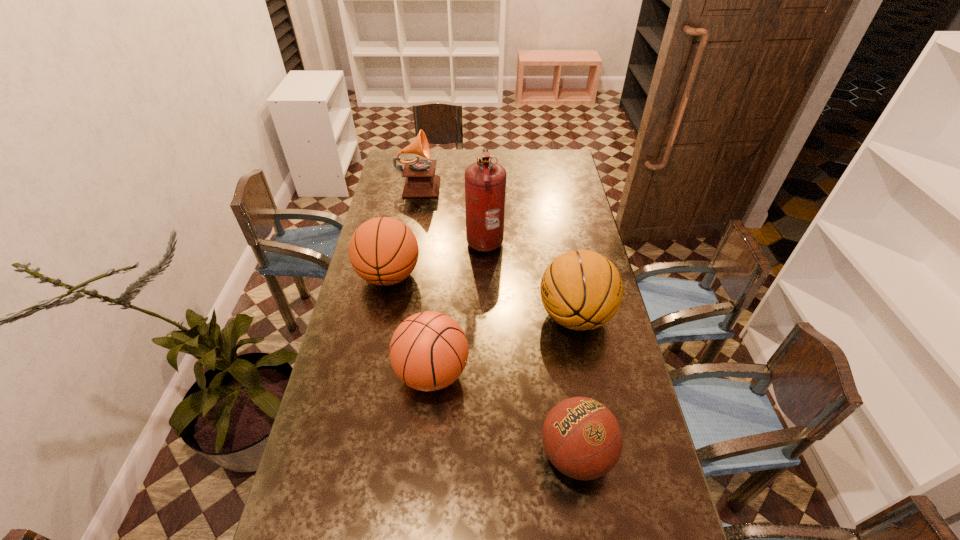
I want to click on phonograph record that is at the left edge, so click(421, 182).

The image size is (960, 540). Identify the location of basketball present at the left edge. (383, 251).

Where is `object that is at the far left corner`? object that is at the far left corner is located at coordinates (421, 182).

Identify the location of blank area at the far edge. (534, 153).

The image size is (960, 540). In order to click on free space at the left edge in this screenshot , I will do `click(331, 394)`.

Locate an element on the screen. This screenshot has height=540, width=960. vacant point at the right edge is located at coordinates (574, 180).

Find the location of `unoccupied area between the fire extinguisher and the farthest object`. unoccupied area between the fire extinguisher and the farthest object is located at coordinates (452, 211).

You are a GUI agent. You are given a task and a screenshot of the screen. Output one action in this format:
    pyautogui.click(x=<x>, y=<y>)
    Task: Click on the vacant space in between the nearest basketball and the tallest object
    This screenshot has height=540, width=960.
    Given the screenshot: What is the action you would take?
    pyautogui.click(x=530, y=347)

You are a GUI agent. You are given a task and a screenshot of the screen. Output one action in this format:
    pyautogui.click(x=<x>, y=<y>)
    Task: Click on the free area in between the tallest object and the nearest object
    The image size is (960, 540).
    Given the screenshot: What is the action you would take?
    pyautogui.click(x=530, y=347)

Where is `object that is the third closest to the phonograph record`? This screenshot has height=540, width=960. object that is the third closest to the phonograph record is located at coordinates (581, 290).